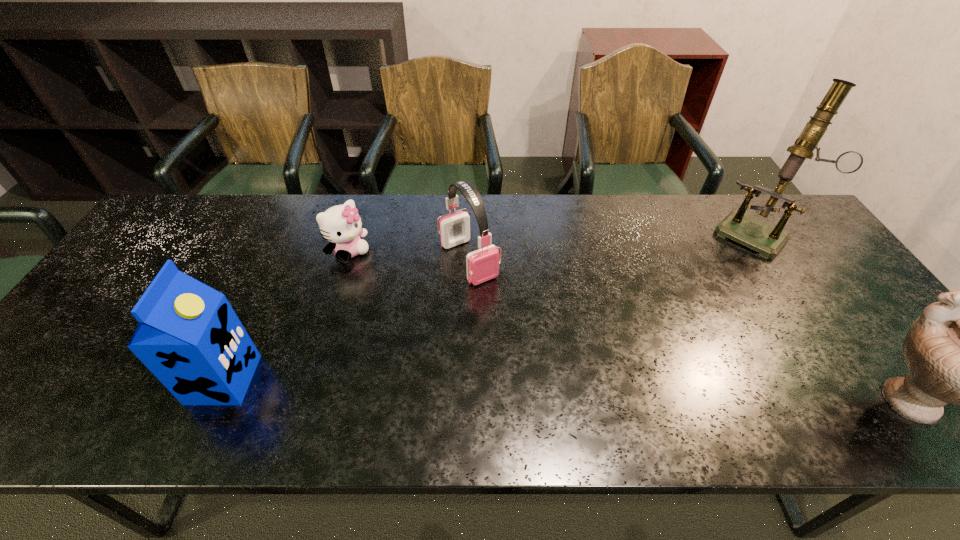
Locate an element on the screen. object that is at the right edge is located at coordinates (768, 240).

Identify the location of object at the far right corner. This screenshot has width=960, height=540. (768, 240).

In the image, there is a desktop. Where is `vacant region at the far edge`? vacant region at the far edge is located at coordinates (688, 213).

In the image, there is a desktop. Where is `vacant area at the near edge`? The width and height of the screenshot is (960, 540). vacant area at the near edge is located at coordinates (831, 382).

The height and width of the screenshot is (540, 960). I want to click on free location at the left edge of the desktop, so click(x=135, y=254).

Locate an element on the screen. vacant space at the right edge of the desktop is located at coordinates (843, 274).

At what (x,y) coordinates should I click in order to perform the action: click on free space at the far left corner of the desktop. Please return your answer as a coordinate pair (x, y). This screenshot has height=540, width=960. Looking at the image, I should click on (170, 233).

You are a GUI agent. You are given a task and a screenshot of the screen. Output one action in this format:
    pyautogui.click(x=<x>, y=<y>)
    Task: Click on the vacant area between the second shortest object and the tallest object
    
    Given the screenshot: What is the action you would take?
    pyautogui.click(x=611, y=247)

Find the location of a particular element. vacant point located between the microscope and the fourth tallest object is located at coordinates (611, 247).

You are a GUI agent. You are given a task and a screenshot of the screen. Output one action in this format:
    pyautogui.click(x=<x>, y=<y>)
    Task: Click on the vacant area that lies between the second object from left to right and the leftmost object
    
    Given the screenshot: What is the action you would take?
    pyautogui.click(x=286, y=316)